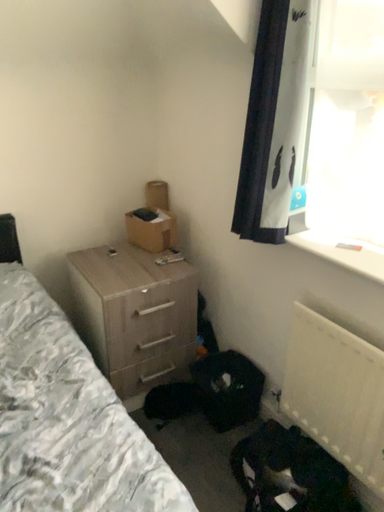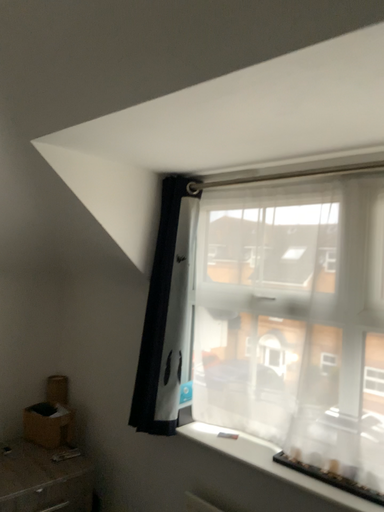
Question: How did the camera likely rotate when shooting the video?

Choices:
 (A) rotated downward
 (B) rotated upward

Answer: (B)